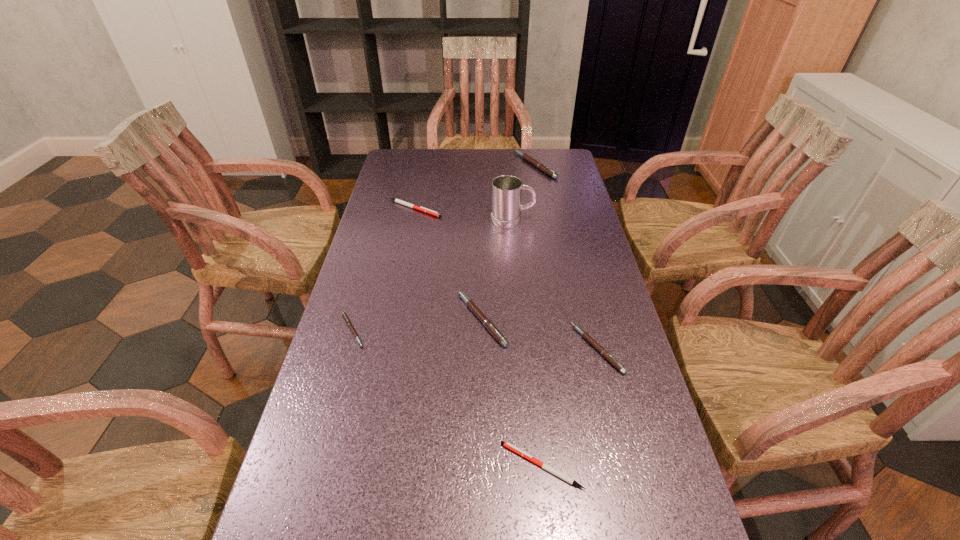
Find the location of a particular element. This screenshot has width=960, height=540. free location located 0.390m at the nib of the second smallest pink pen is located at coordinates (415, 349).

This screenshot has width=960, height=540. In order to click on blank space located 0.180m at the nib of the second smallest pink pen in this screenshot , I will do `click(502, 349)`.

The image size is (960, 540). I want to click on blank area located on the clicker of the farther white pen, so click(x=492, y=208).

Find the location of a particular element. free location located at the nib of the smallest pink pen is located at coordinates (522, 330).

Where is `vacant position located on the clicker of the nearer white pen`? vacant position located on the clicker of the nearer white pen is located at coordinates (351, 465).

The image size is (960, 540). I want to click on vacant area situated on the clicker of the nearer white pen, so click(470, 465).

The image size is (960, 540). I want to click on free location located on the clicker of the nearer white pen, so click(419, 465).

Locate an element on the screen. This screenshot has width=960, height=540. object located at the far edge is located at coordinates (542, 167).

This screenshot has width=960, height=540. I want to click on object that is at the far right corner, so click(x=542, y=167).

Identify the location of vacant space at the far edge of the desktop. The image size is (960, 540). (432, 159).